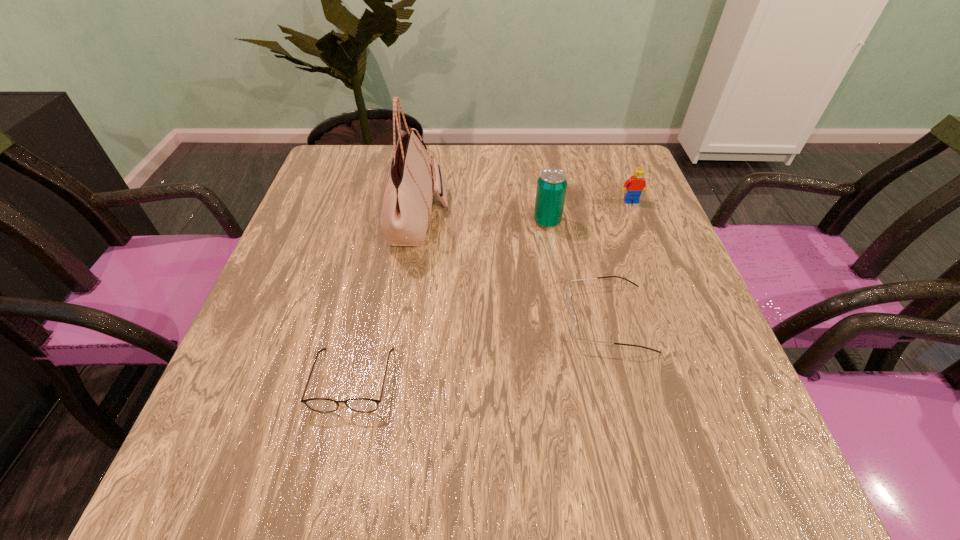
Find the location of a particular element. handbag is located at coordinates (406, 208).

The image size is (960, 540). What are the coordinates of `the second tallest object` in the screenshot? It's located at (551, 185).

Image resolution: width=960 pixels, height=540 pixels. Identify the location of the third tallest object. (634, 186).

Image resolution: width=960 pixels, height=540 pixels. What are the coordinates of `the rightmost object` in the screenshot? It's located at (634, 186).

The width and height of the screenshot is (960, 540). I want to click on the right spectacles, so click(572, 322).

This screenshot has height=540, width=960. Identify the location of the shortest object. (364, 405).

You are a GUI agent. You are given a task and a screenshot of the screen. Output one action in this format:
    pyautogui.click(x=<x>, y=<y>)
    Task: Click on the shorter spectacles
    
    Given the screenshot: What is the action you would take?
    pyautogui.click(x=364, y=405)

Locate an element on the screen. The image size is (960, 540). free space located 0.270m on the side of the tallest object with the attached pouch is located at coordinates (558, 218).

Image resolution: width=960 pixels, height=540 pixels. I want to click on vacant space located on the front of the beer can, so click(x=551, y=247).

The width and height of the screenshot is (960, 540). Find the location of `free space located on the face of the third shortest object`. free space located on the face of the third shortest object is located at coordinates (678, 319).